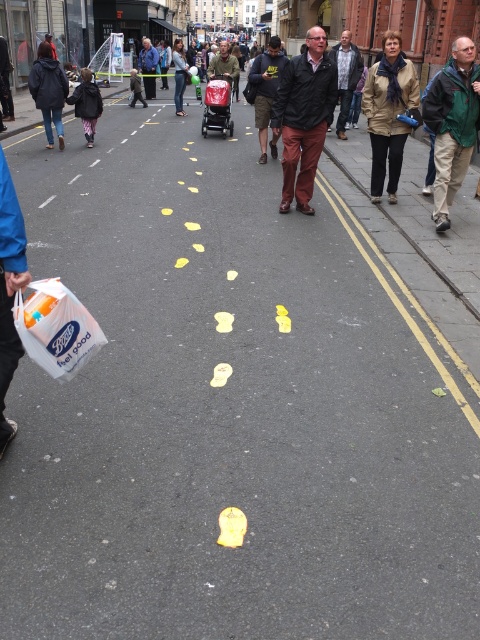
Between dark brown leather jacket at center and dark green jacket at center, which one appears on the right side from the viewer's perspective?

dark brown leather jacket at center is more to the right.

Is dark brown leather jacket at center bigger than dark green jacket at center?

No, dark brown leather jacket at center is not bigger than dark green jacket at center.

Between point (282, 196) and point (278, 45), which one is positioned in front?

Point (282, 196) is more forward.

This screenshot has height=640, width=480. I want to click on dark brown leather jacket at center, so click(303, 116).

Between point (349, 38) and point (228, 83), which one is positioned in front?

Point (349, 38) is in front.

Which is more to the right, light brown leather jacket at center or matte green jacket at center?

light brown leather jacket at center

Is point (348, 93) positioned before point (236, 77)?

Yes, point (348, 93) is in front of point (236, 77).

Find the location of a particular element. light brown leather jacket at center is located at coordinates (346, 76).

In the scene shown: Which is more to the right, green jacket at right or light brown leather jacket at center?

Positioned to the right is green jacket at right.

Does green jacket at right appear on the right side of light brown leather jacket at center?

Indeed, green jacket at right is positioned on the right side of light brown leather jacket at center.

Where is `green jacket at right`? The image size is (480, 640). green jacket at right is located at coordinates (453, 124).

The image size is (480, 640). I want to click on green jacket at right, so click(453, 124).